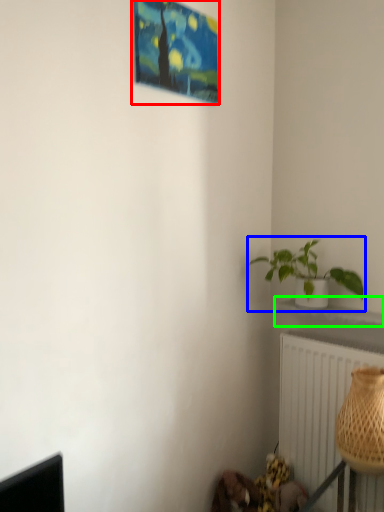
Question: Considering the real-world distances, which object is farthest from picture frame (highlighted by a red box)? houseplant (highlighted by a blue box) or window sill (highlighted by a green box)?

Choices:
 (A) houseplant
 (B) window sill

Answer: (B)